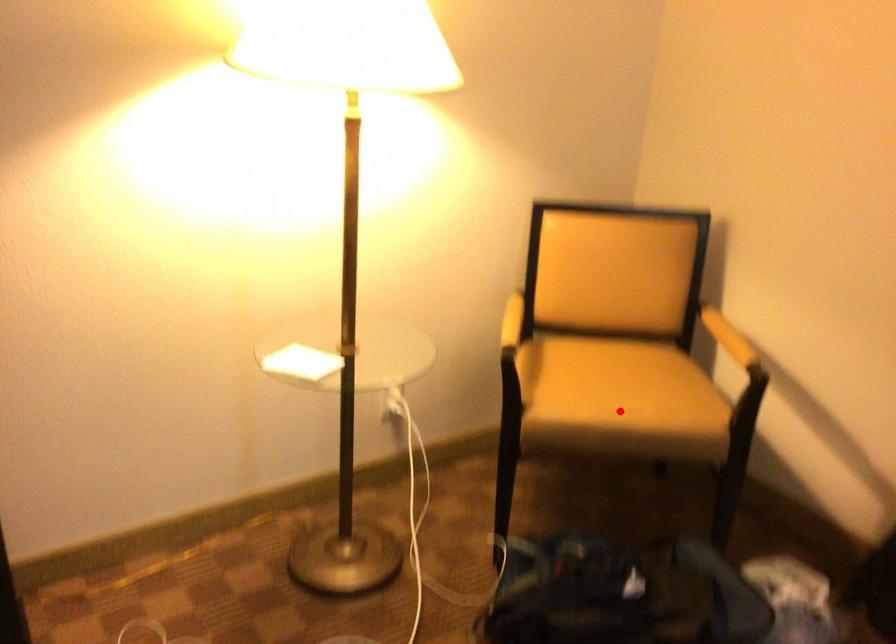
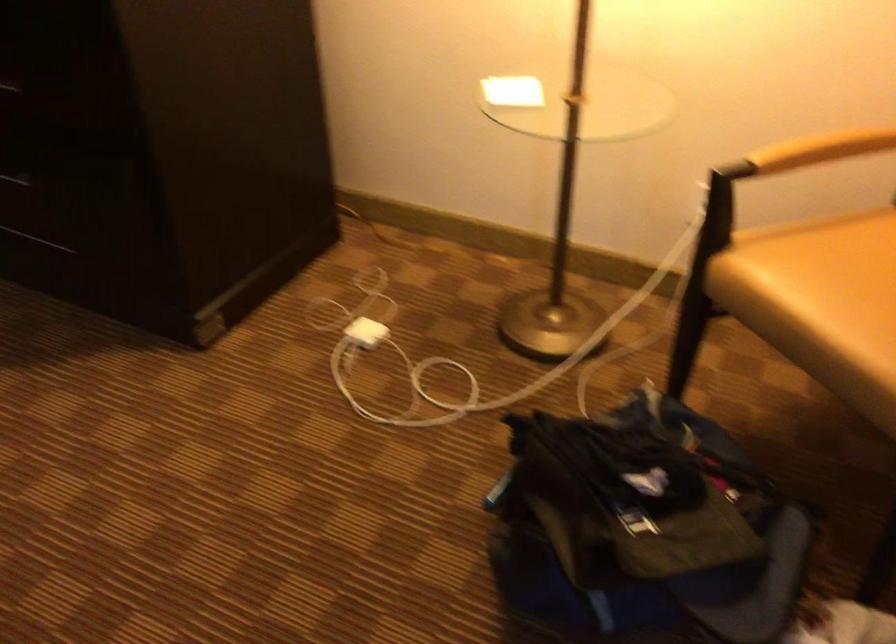
Question: I am providing you with two images of the same scene from different viewpoints. A red point is marked on the first image. At the location where the point appears in image 1, is it still visible in image 2?

Choices:
 (A) Yes
 (B) No

Answer: (A)